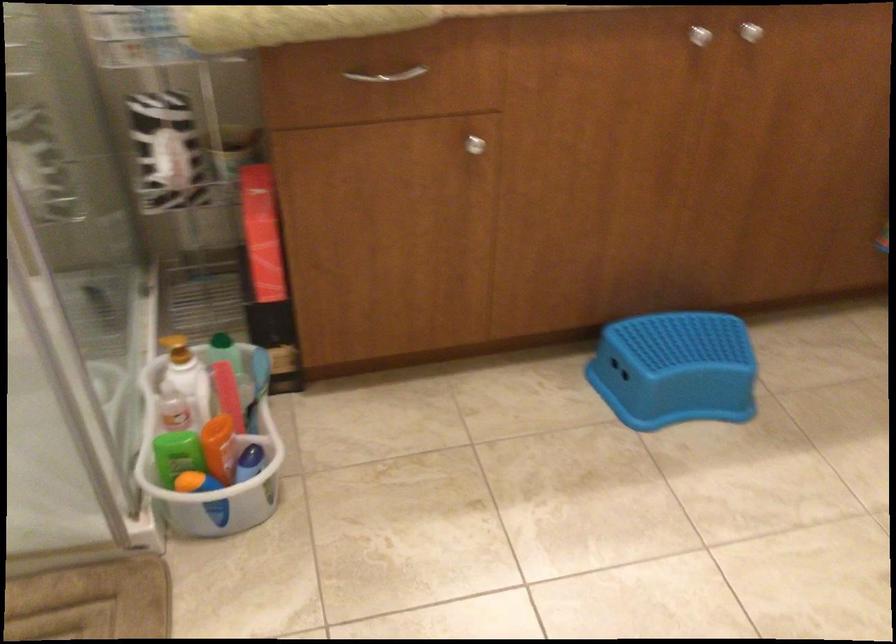
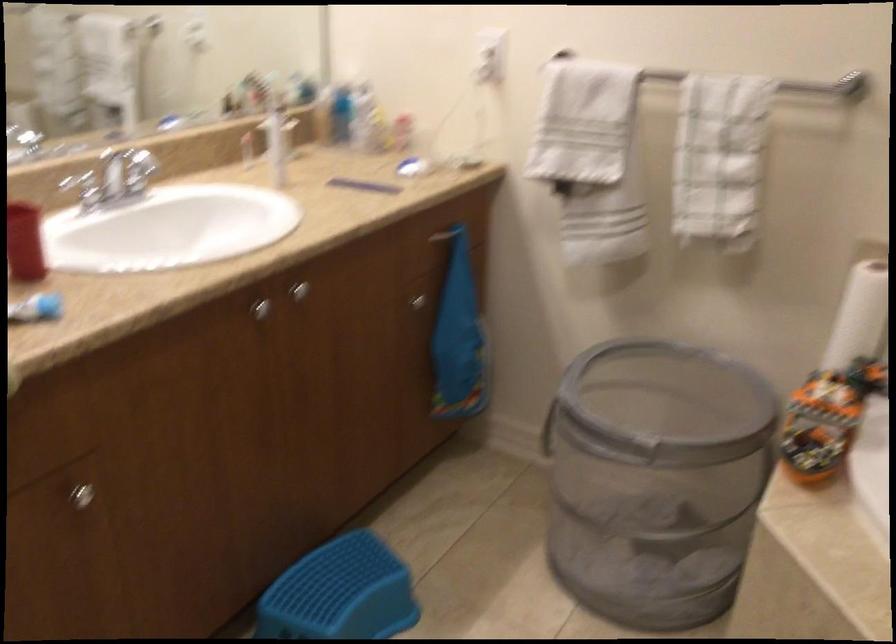
Question: How did the camera likely rotate?

Choices:
 (A) Left
 (B) Right
 (C) Up
 (D) Down

Answer: (B)